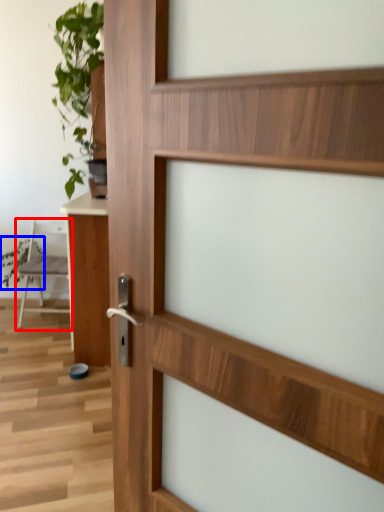
Question: Which of the following is the farthest to the observer, chair (highlighted by a red box) or plant (highlighted by a blue box)?

Choices:
 (A) chair
 (B) plant

Answer: (B)